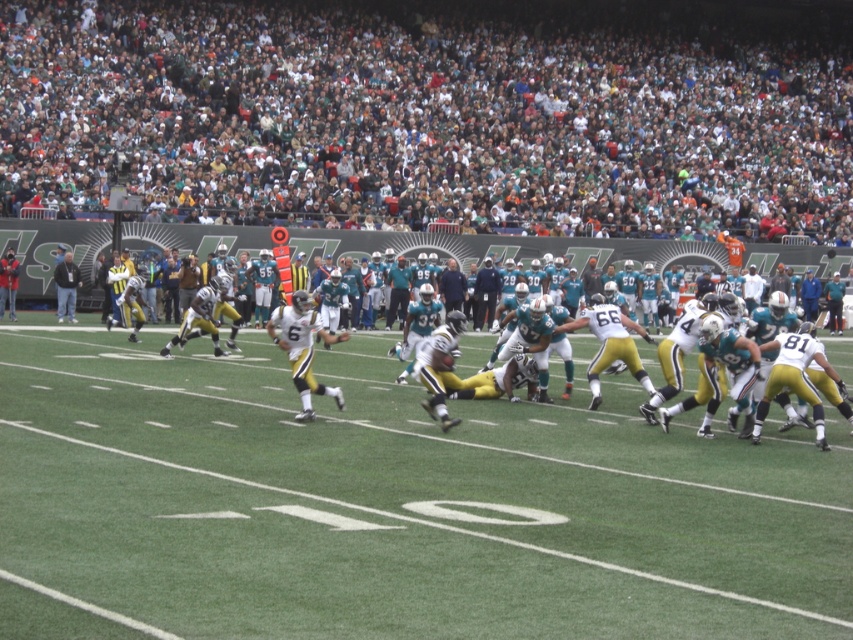
You are a photographer at the American football game and want to capture the crowd in the white fabric crowd at upper center. What are the coordinates where you should focus your camera?

The white fabric crowd at upper center is located at coordinates point (415, 124).

Looking at this image, you are a photographer at the stadium and want to capture a photo of the white jersey at center without the white fabric crowd at upper center blocking the view. Is this possible based on their positions?

The white fabric crowd at upper center is above the white jersey at center, so it will block the view. You need to adjust your angle or position to avoid the crowd.